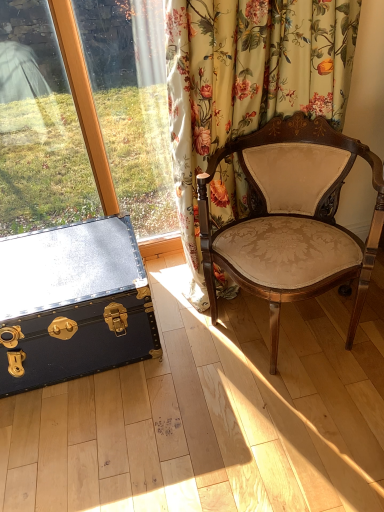
Question: From the image's perspective, would you say floral fabric curtain at upper right is positioned over black leather trunk at lower left?

Choices:
 (A) yes
 (B) no

Answer: (A)

Question: Are floral fabric curtain at upper right and black leather trunk at lower left beside each other?

Choices:
 (A) no
 (B) yes

Answer: (A)

Question: Considering the relative sizes of floral fabric curtain at upper right and black leather trunk at lower left in the image provided, is floral fabric curtain at upper right wider than black leather trunk at lower left?

Choices:
 (A) yes
 (B) no

Answer: (B)

Question: Is floral fabric curtain at upper right far away from black leather trunk at lower left?

Choices:
 (A) no
 (B) yes

Answer: (A)

Question: Is floral fabric curtain at upper right looking in the opposite direction of black leather trunk at lower left?

Choices:
 (A) no
 (B) yes

Answer: (A)

Question: Relative to velvet beige chair at center, is floral fabric curtain at upper right in front or behind?

Choices:
 (A) behind
 (B) front

Answer: (A)

Question: Would you say floral fabric curtain at upper right is to the left or to the right of velvet beige chair at center in the picture?

Choices:
 (A) left
 (B) right

Answer: (A)

Question: From a real-world perspective, is floral fabric curtain at upper right physically located above or below velvet beige chair at center?

Choices:
 (A) above
 (B) below

Answer: (A)

Question: Considering the positions of point (243, 197) and point (334, 206), is point (243, 197) closer or farther from the camera than point (334, 206)?

Choices:
 (A) closer
 (B) farther

Answer: (A)

Question: Looking at the image, does black leather trunk at lower left seem bigger or smaller compared to floral fabric curtain at upper right?

Choices:
 (A) small
 (B) big

Answer: (A)

Question: From a real-world perspective, is black leather trunk at lower left above or below floral fabric curtain at upper right?

Choices:
 (A) above
 (B) below

Answer: (B)

Question: From the image's perspective, is black leather trunk at lower left located above or below floral fabric curtain at upper right?

Choices:
 (A) below
 (B) above

Answer: (A)

Question: Based on their positions, is black leather trunk at lower left located to the left or right of floral fabric curtain at upper right?

Choices:
 (A) right
 (B) left

Answer: (B)

Question: From the image's perspective, is velvet beige chair at center positioned above or below floral fabric curtain at upper right?

Choices:
 (A) above
 (B) below

Answer: (B)

Question: From their relative heights in the image, would you say velvet beige chair at center is taller or shorter than floral fabric curtain at upper right?

Choices:
 (A) short
 (B) tall

Answer: (A)